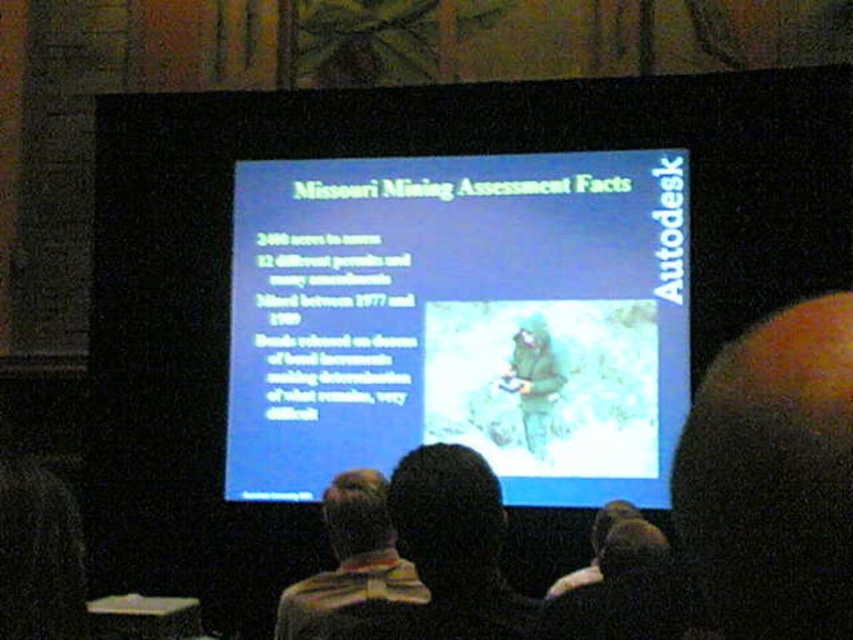
Measure the distance between point (631, 157) and camera.

Point (631, 157) is 58.49 feet from camera.

Looking at this image, does blue matte screen at center lie in front of dark brown hair at upper right?

Yes, it is in front of dark brown hair at upper right.

The height and width of the screenshot is (640, 853). I want to click on blue matte screen at center, so click(x=460, y=321).

Does dark brown hair at upper right have a greater width compared to striped shirt at center?

Incorrect, dark brown hair at upper right's width does not surpass striped shirt at center's.

Who is taller, dark brown hair at upper right or striped shirt at center?

striped shirt at center

I want to click on dark brown hair at upper right, so click(x=773, y=477).

Can you confirm if blue matte screen at center is positioned below striped shirt at center?

No.

Which is in front, point (550, 324) or point (344, 532)?

Positioned in front is point (344, 532).

I want to click on blue matte screen at center, so click(x=460, y=321).